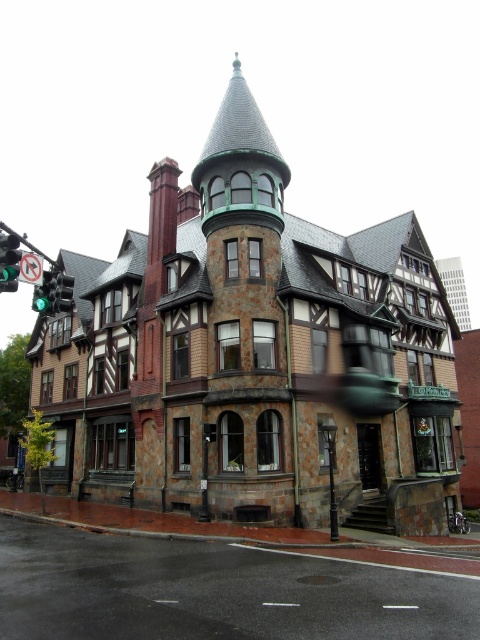
Between green glass traffic light at upper left and green glass traffic light at left, which one has less height?

green glass traffic light at left is shorter.

Is green glass traffic light at upper left smaller than green glass traffic light at left?

Correct, green glass traffic light at upper left occupies less space than green glass traffic light at left.

Is point (14, 243) less distant than point (60, 310)?

Yes, point (14, 243) is in front of point (60, 310).

Where is `green glass traffic light at upper left`? green glass traffic light at upper left is located at coordinates (9, 260).

Does point (321, 589) come closer to viewer compared to point (10, 237)?

No, it is not.

Which is more to the right, dark asphalt road at lower center or green glass traffic light at upper left?

Positioned to the right is dark asphalt road at lower center.

Where is `dark asphalt road at lower center`? This screenshot has height=640, width=480. dark asphalt road at lower center is located at coordinates (216, 592).

What do you see at coordinates (216, 592) in the screenshot? This screenshot has width=480, height=640. I see `dark asphalt road at lower center` at bounding box center [216, 592].

Can you confirm if dark asphalt road at lower center is shorter than green glass traffic light at left?

No.

Is point (238, 545) positioned after point (56, 285)?

Yes, it is behind point (56, 285).

Locate an element on the screen. The height and width of the screenshot is (640, 480). dark asphalt road at lower center is located at coordinates (216, 592).